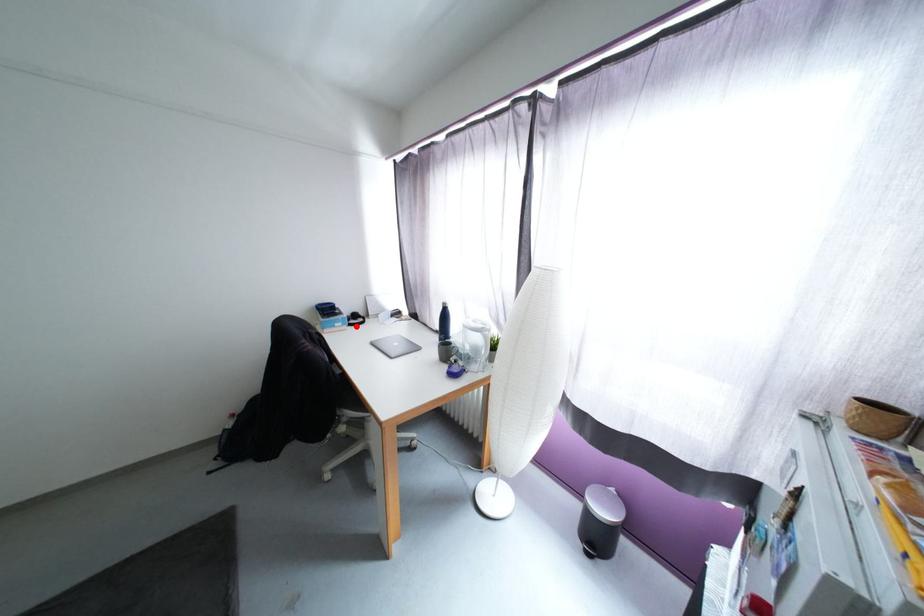
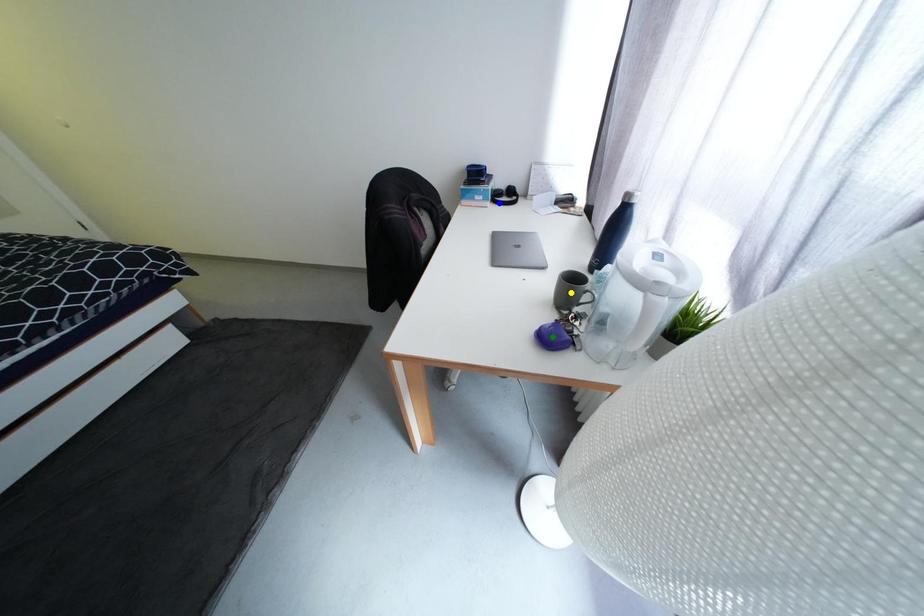
Question: I am providing you with two images of the same scene from different viewpoints. A red point is marked on the first image. You are given multiple points on the second image. Which spot in image 2 lines up with the point in image 1?

Choices:
 (A) yellow point
 (B) green point
 (C) blue point

Answer: (C)